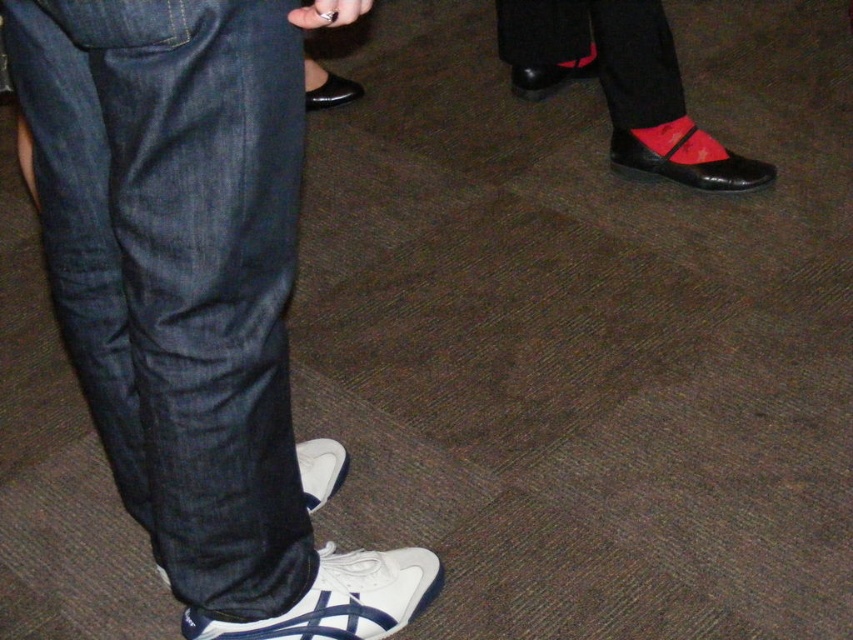
You are standing at the origin point in the image and want to move towards the two points marked as point (91, 218) and point (549, 65). Which point should you reach first if you move in a straight line towards both?

Point (91, 218) is in front of point (549, 65), so you should reach point (91, 218) first.